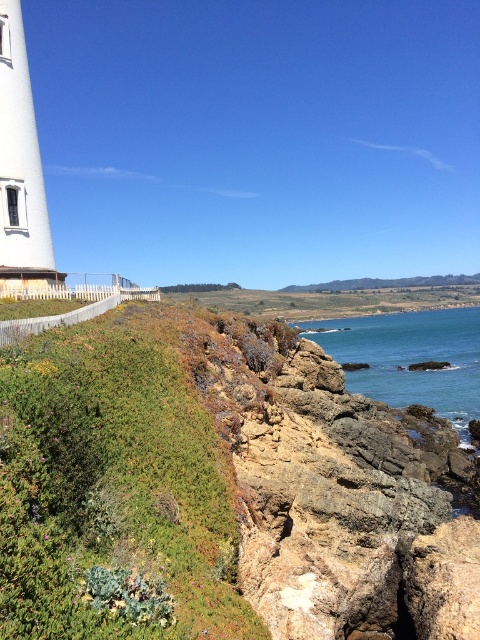
Question: Can you confirm if green grassy hillside at lower left is bigger than blue water at lower right?

Choices:
 (A) yes
 (B) no

Answer: (B)

Question: Which is farther from the white matte lighthouse at left?

Choices:
 (A) blue water at lower right
 (B) green grassy hillside at lower left

Answer: (A)

Question: Is blue water at lower right above white matte lighthouse at left?

Choices:
 (A) no
 (B) yes

Answer: (A)

Question: Which of the following is the closest to the observer?

Choices:
 (A) green grassy hillside at lower left
 (B) white matte lighthouse at left

Answer: (A)

Question: Based on their relative distances, which object is farther from the blue water at lower right?

Choices:
 (A) white matte lighthouse at left
 (B) green grassy hillside at lower left

Answer: (A)

Question: Considering the relative positions of green grassy hillside at lower left and white matte lighthouse at left in the image provided, where is green grassy hillside at lower left located with respect to white matte lighthouse at left?

Choices:
 (A) right
 (B) left

Answer: (A)